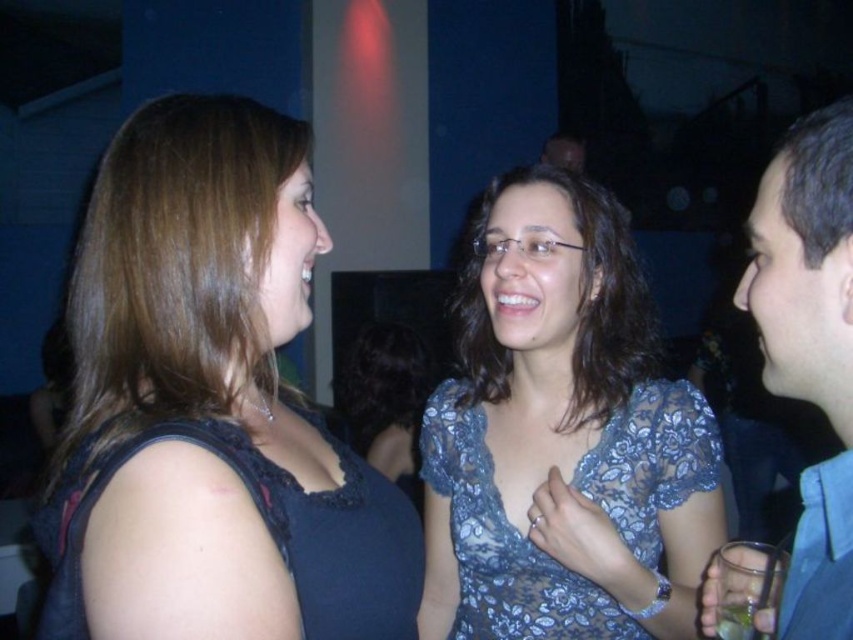
Question: Which object appears farthest from the camera in this image?

Choices:
 (A) blue fabric shirt at right
 (B) lacy blue dress at center
 (C) green glass at lower right
 (D) dark blue lace dress at left

Answer: (B)

Question: From the image, what is the correct spatial relationship of matte black top at left in relation to blue fabric shirt at right?

Choices:
 (A) left
 (B) right

Answer: (A)

Question: Where is lacy blue dress at center located in relation to dark blue lace dress at left in the image?

Choices:
 (A) below
 (B) above

Answer: (B)

Question: Which point is farther to the camera?

Choices:
 (A) matte black top at left
 (B) blue fabric shirt at right
 (C) green glass at lower right
 (D) lacy blue dress at center

Answer: (D)

Question: Estimate the real-world distances between objects in this image. Which object is farther from the lacy blue dress at center?

Choices:
 (A) dark blue lace dress at left
 (B) blue fabric shirt at right
 (C) green glass at lower right
 (D) matte black top at left

Answer: (C)

Question: Does dark blue lace dress at left appear under green glass at lower right?

Choices:
 (A) no
 (B) yes

Answer: (A)